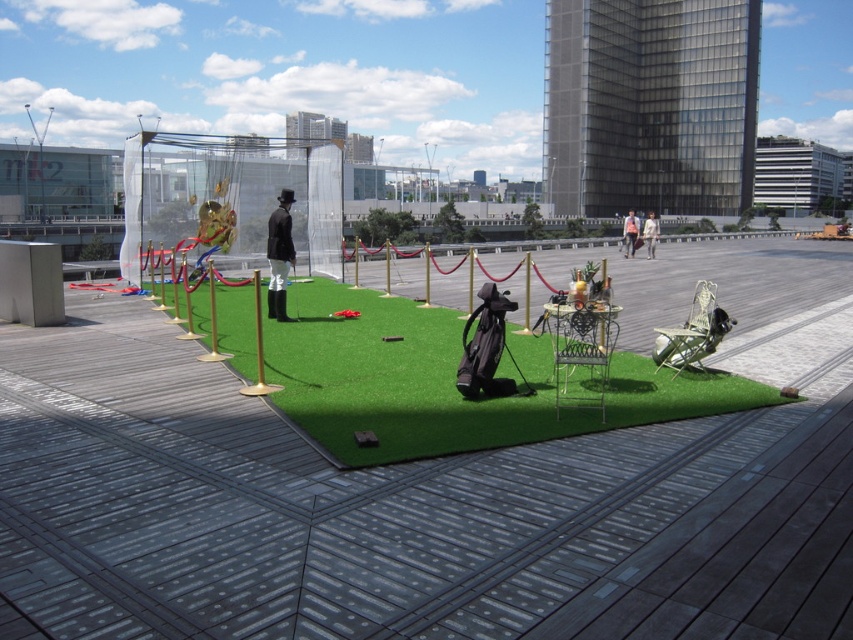
You are a photographer setting up equipment on the rooftop. You have two metallic silver chairs to position. The first is the metallic silver chair at center and the second is the metallic silver chair at lower right. Based on the scene, which chair is positioned more to the east?

The metallic silver chair at lower right is positioned more to the east because it is to the right of the metallic silver chair at center, and in the scene, right corresponds to east direction.

You are standing at the camera position and want to reach point B, which is located at coordinates point (589, 348). However, there is an obstacle at point A, which is at coordinates point (196, 298). Can you walk directly from your current position to point B without passing through point A?

Point (196, 298) is closer to the camera than point (589, 348). Since point A is closer to you, you would encounter it before reaching point B. Therefore, you cannot walk directly to point B without passing through point A.

You are standing at the origin point of the image coordinate system, which is the bottom left corner. You want to move towards the metallic silver chair at center. In which direction should you move first?

Since the metallic silver chair at center has coordinates at point (582, 353), you should move northeast first to reach it.